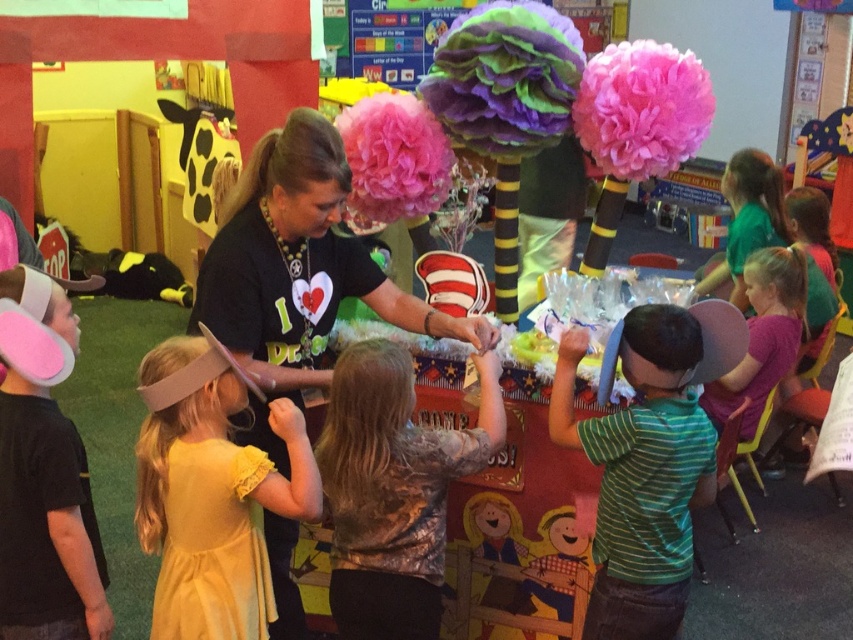
The image size is (853, 640). Describe the element at coordinates (212, 493) in the screenshot. I see `yellow satin dress at center` at that location.

Can you confirm if yellow satin dress at center is smaller than green striped shirt at center?

Correct, yellow satin dress at center occupies less space than green striped shirt at center.

Which is behind, point (137, 513) or point (573, 365)?

The point (573, 365) is more distant.

The image size is (853, 640). What are the coordinates of `yellow satin dress at center` in the screenshot? It's located at (212, 493).

Is camouflage shirt at center shorter than green striped shirt at center?

Indeed, camouflage shirt at center has a lesser height compared to green striped shirt at center.

Can you confirm if camouflage shirt at center is bigger than green striped shirt at center?

Yes, camouflage shirt at center is bigger than green striped shirt at center.

Where is `camouflage shirt at center`? The image size is (853, 640). camouflage shirt at center is located at coordinates (392, 490).

Is point (293, 380) positioned after point (608, 429)?

Yes, it is behind point (608, 429).

Where is `black matte shirt at center`? This screenshot has height=640, width=853. black matte shirt at center is located at coordinates (299, 264).